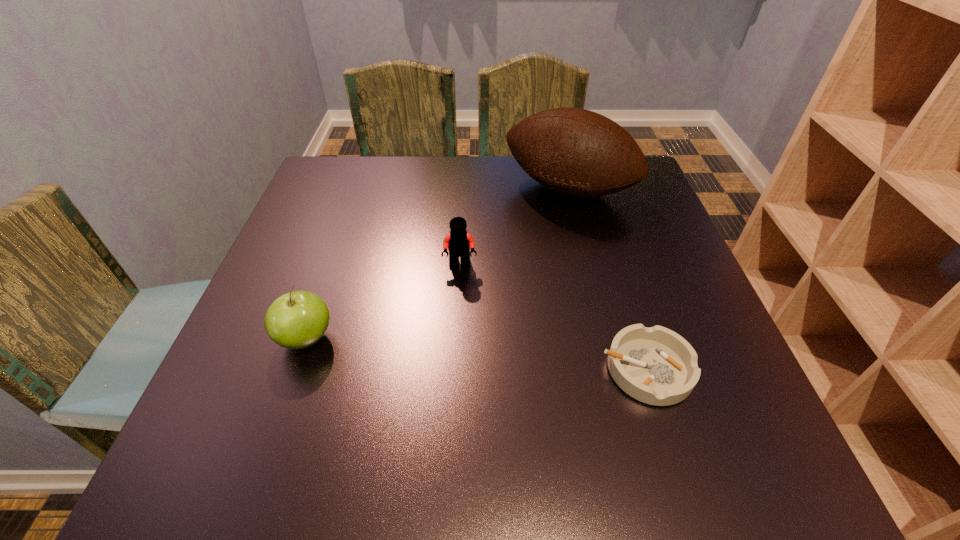
I want to click on free space between the ashtray and the apple, so click(x=476, y=354).

Locate an element on the screen. free point between the shortest object and the leftmost object is located at coordinates (476, 354).

Locate an element on the screen. This screenshot has width=960, height=540. vacant space in between the apple and the football is located at coordinates (438, 264).

Locate an element on the screen. Image resolution: width=960 pixels, height=540 pixels. blank region between the third nearest object and the farthest object is located at coordinates (515, 227).

The width and height of the screenshot is (960, 540). Find the location of `free space between the apple and the shortest object`. free space between the apple and the shortest object is located at coordinates (476, 354).

Find the location of a particular element. free spot between the farthest object and the Lego is located at coordinates (515, 227).

Locate an element on the screen. This screenshot has height=540, width=960. vacant space that is in between the second farthest object and the shortest object is located at coordinates (553, 318).

Find the location of a particular element. empty space that is in between the tallest object and the apple is located at coordinates (438, 264).

The height and width of the screenshot is (540, 960). Identify the location of object that is the second nearest to the Lego. (298, 319).

Locate which object ranks third in proximity to the football. Please provide its 2D coordinates. Your answer should be formatted as a tuple, i.e. [(x, y)], where the tuple contains the x and y coordinates of a point satisfying the conditions above.

[(298, 319)]